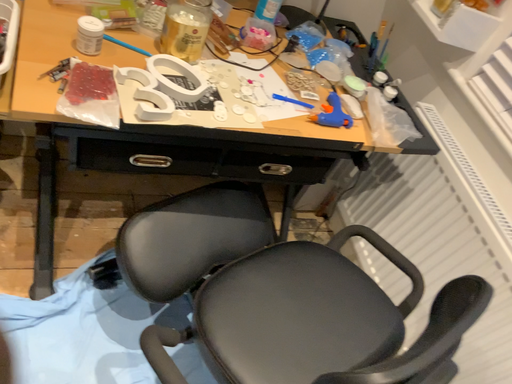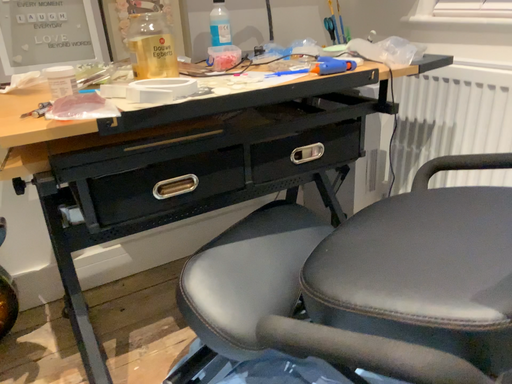
Question: Which way did the camera rotate in the video?

Choices:
 (A) rotated upward
 (B) rotated downward

Answer: (A)